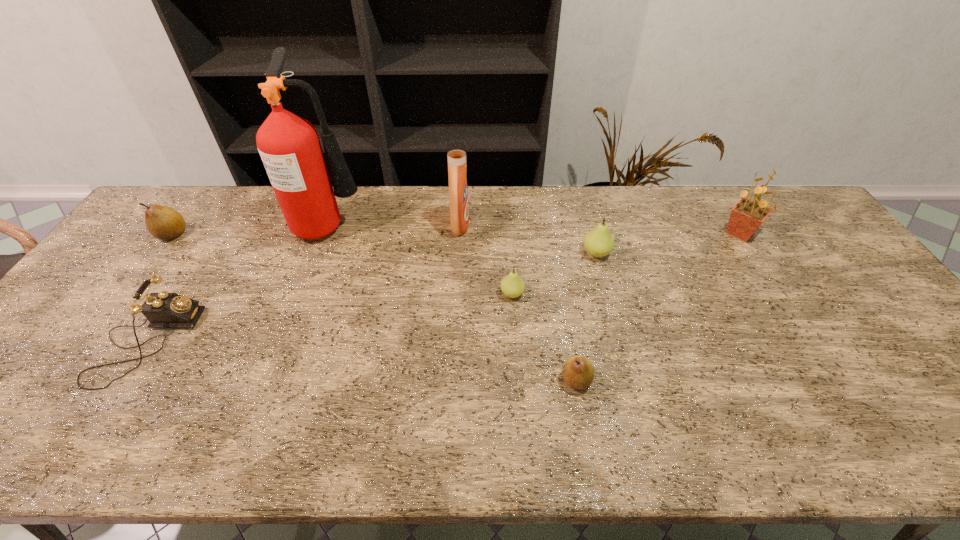
What are the coordinates of `telephone` in the screenshot? It's located at (163, 310).

Image resolution: width=960 pixels, height=540 pixels. Find the location of `the fourth object from right to left`. the fourth object from right to left is located at coordinates (512, 285).

What are the coordinates of `the left green pear` in the screenshot? It's located at (512, 285).

Where is `the smaller brown pear`? the smaller brown pear is located at coordinates (578, 372).

You are a GUI agent. You are given a task and a screenshot of the screen. Output one action in this format:
    pyautogui.click(x=<x>, y=<y>)
    Task: Click on the nearer brown pear
    Image resolution: width=960 pixels, height=540 pixels.
    Given the screenshot: What is the action you would take?
    pyautogui.click(x=578, y=372)

This screenshot has height=540, width=960. I want to click on free space located at the nozzle of the red fire extinguisher, so click(404, 224).

Identify the location of blank space located 0.300m on the front-facing side of the detergent. (563, 225).

Find the location of a particular element. The image size is (960, 540). vacant space located at the front of the rightmost object with flowers visible is located at coordinates (685, 233).

In order to click on free space located 0.390m at the front of the rightmost object with flowers visible in this screenshot , I will do [x=596, y=233].

At what (x,y) coordinates should I click in order to perform the action: click on vacant point located at the front of the rightmost object with flowers visible. Please return your answer as a coordinate pair (x, y). The height and width of the screenshot is (540, 960). Looking at the image, I should click on [x=688, y=233].